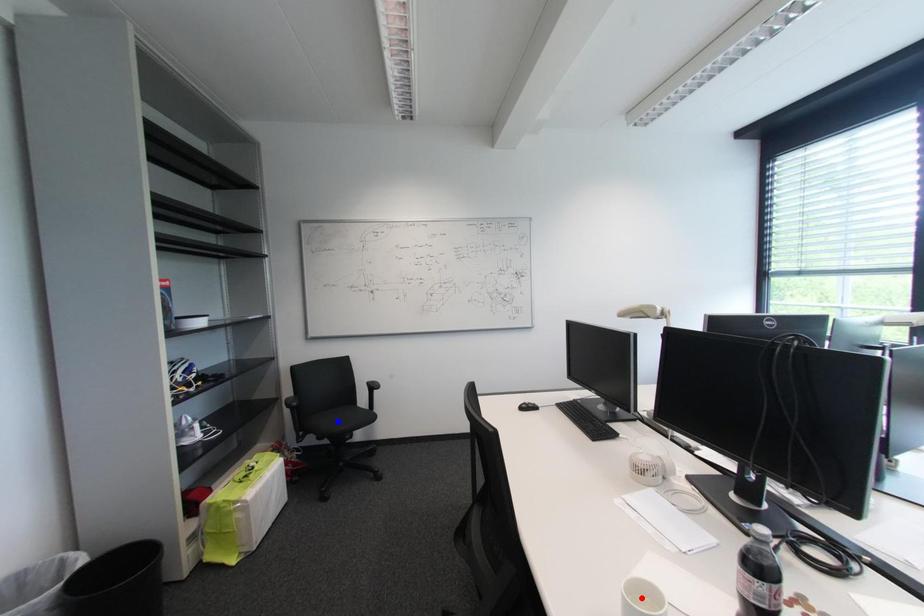
Question: In the image, two points are highlighted. Which point is nearer to the camera? Reply with the corresponding letter.

Choices:
 (A) blue point
 (B) red point

Answer: (B)